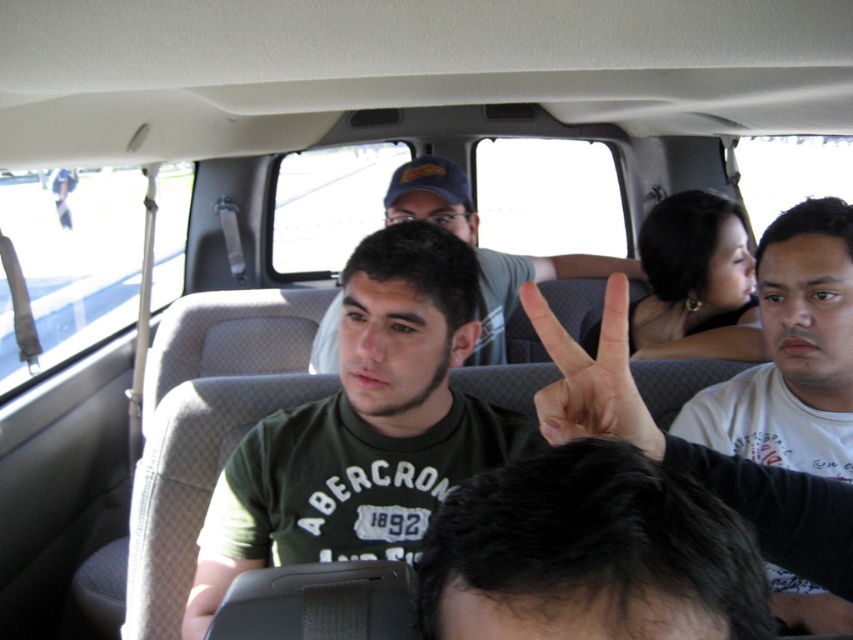
Question: Is green matte shirt at center smaller than white matte hand at center?

Choices:
 (A) no
 (B) yes

Answer: (A)

Question: Which object is farther from the camera taking this photo?

Choices:
 (A) green matte shirt at center
 (B) white cotton shirt at upper right

Answer: (B)

Question: Does white cotton shirt at upper right have a lesser width compared to green cotton shirt at center?

Choices:
 (A) no
 (B) yes

Answer: (B)

Question: Which of these objects is positioned closest to the white matte hand at center?

Choices:
 (A) green cotton shirt at center
 (B) white cotton shirt at upper right

Answer: (B)

Question: Is green matte shirt at center closer to camera compared to white matte hand at center?

Choices:
 (A) yes
 (B) no

Answer: (B)

Question: Which object appears closest to the camera in this image?

Choices:
 (A) white cotton shirt at upper right
 (B) white matte hand at center

Answer: (B)